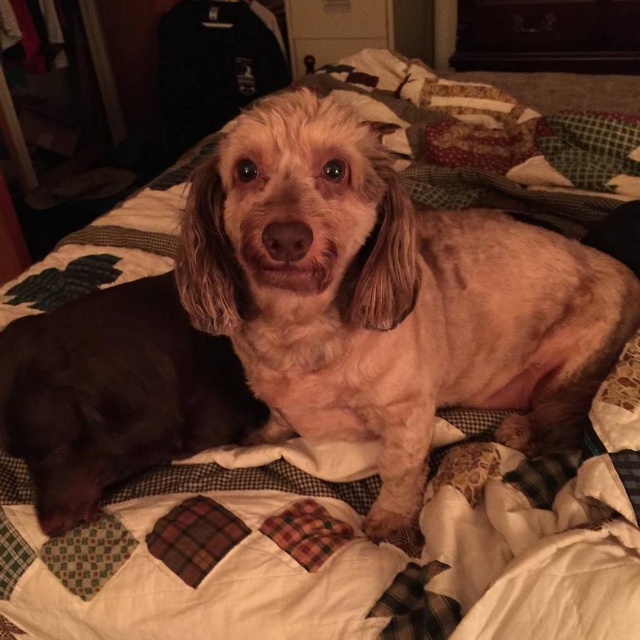
You are a photographer trying to capture the perfect shot of the dogs in the image. Since you want to ensure both the fuzzy brown dog at center and the brown fur dog at center are visible, which one should you focus on first to avoid blurring due to their positions?

The fuzzy brown dog at center is positioned on the right side of brown fur dog at center, so you should focus on the brown fur dog at center first as it is closer to the camera.

You are a photographer trying to capture the perfect shot of the dog on the quilted blanket. You notice two points on the blanket marked as point (317, 125) and point (93, 392). If you want to position your camera so that the first point is visible but the second is hidden behind the dog, where should you place the camera relative to the dog?

Place the camera behind the dog so that point (317, 125) is visible in front and point (93, 392) is hidden behind the dog, since point (317, 125) is in front of point (93, 392).